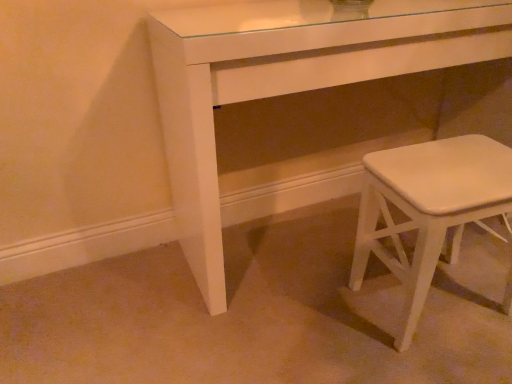
Question: Should I look upward or downward to see white glossy table at center?

Choices:
 (A) down
 (B) up

Answer: (B)

Question: From a real-world perspective, is white glossy table at center below white matte stool at lower right?

Choices:
 (A) no
 (B) yes

Answer: (A)

Question: Does white glossy table at center have a smaller size compared to white matte stool at lower right?

Choices:
 (A) yes
 (B) no

Answer: (B)

Question: Is white glossy table at center positioned beyond the bounds of white matte stool at lower right?

Choices:
 (A) yes
 (B) no

Answer: (A)

Question: Is white glossy table at center far from white matte stool at lower right?

Choices:
 (A) no
 (B) yes

Answer: (A)

Question: From the image's perspective, does white glossy table at center appear higher than white matte stool at lower right?

Choices:
 (A) no
 (B) yes

Answer: (B)

Question: Is white glossy table at center behind white matte stool at lower right?

Choices:
 (A) yes
 (B) no

Answer: (B)

Question: Is white matte stool at lower right far from white glossy table at center?

Choices:
 (A) yes
 (B) no

Answer: (B)

Question: From the image's perspective, is white matte stool at lower right over white glossy table at center?

Choices:
 (A) yes
 (B) no

Answer: (B)

Question: Does white matte stool at lower right come behind white glossy table at center?

Choices:
 (A) no
 (B) yes

Answer: (B)

Question: Are white matte stool at lower right and white glossy table at center making contact?

Choices:
 (A) yes
 (B) no

Answer: (B)

Question: Does white matte stool at lower right lie in front of white glossy table at center?

Choices:
 (A) yes
 (B) no

Answer: (B)

Question: From a real-world perspective, is white matte stool at lower right beneath white glossy table at center?

Choices:
 (A) yes
 (B) no

Answer: (A)

Question: Is white glossy table at center situated inside white matte stool at lower right or outside?

Choices:
 (A) outside
 (B) inside

Answer: (A)